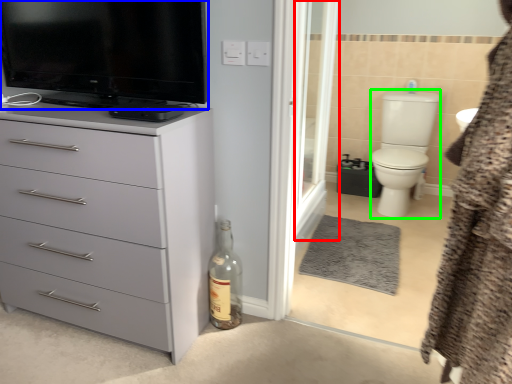
Question: Considering the real-world distances, which object is farthest from screen door (highlighted by a red box)? television (highlighted by a blue box) or toilet bowl (highlighted by a green box)?

Choices:
 (A) television
 (B) toilet bowl

Answer: (A)